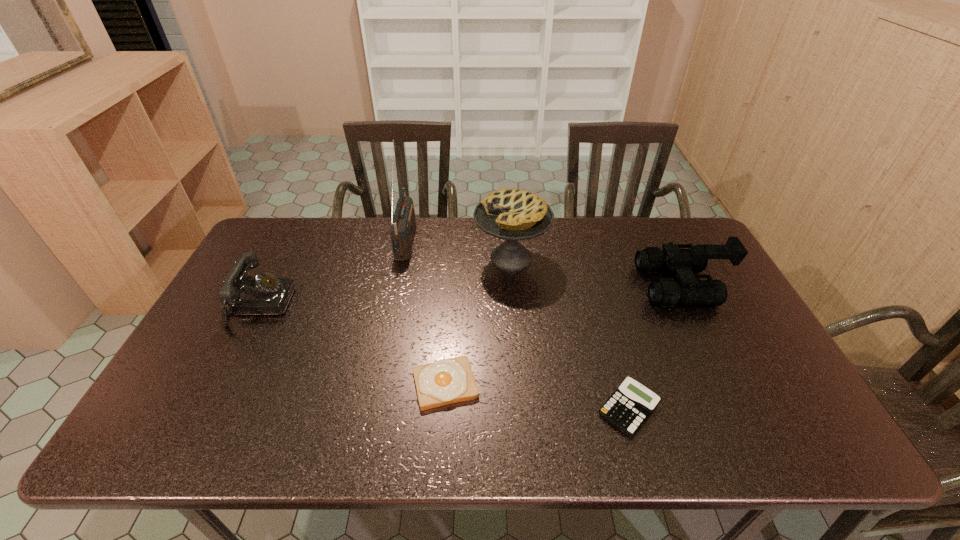
Where is `free space between the toast and the fourth shortest object`? free space between the toast and the fourth shortest object is located at coordinates (564, 335).

At what (x,y) coordinates should I click in order to perform the action: click on empty space between the toast and the fifth shortest object. Please return your answer as a coordinate pair (x, y). This screenshot has height=540, width=960. Looking at the image, I should click on (478, 321).

Locate an element on the screen. This screenshot has height=540, width=960. free space between the second tallest object and the telephone is located at coordinates (386, 281).

This screenshot has height=540, width=960. I want to click on vacant area between the toast and the radio receiver, so click(425, 311).

Find the location of a particular element. Image resolution: width=960 pixels, height=540 pixels. free space between the fifth object from left to right and the rightmost object is located at coordinates (656, 347).

Locate an element on the screen. free space between the leftmost object and the tallest object is located at coordinates (333, 272).

Find the location of a particular element. vacant area between the toast and the pie is located at coordinates (478, 321).

Where is `vacant area that lies between the fourth tallest object and the pie`? vacant area that lies between the fourth tallest object and the pie is located at coordinates (386, 281).

Identify the location of vacant space in between the second object from right to left and the toast. Image resolution: width=960 pixels, height=540 pixels. (537, 396).

Where is `object that is the fourth closest one to the pie`? object that is the fourth closest one to the pie is located at coordinates (628, 408).